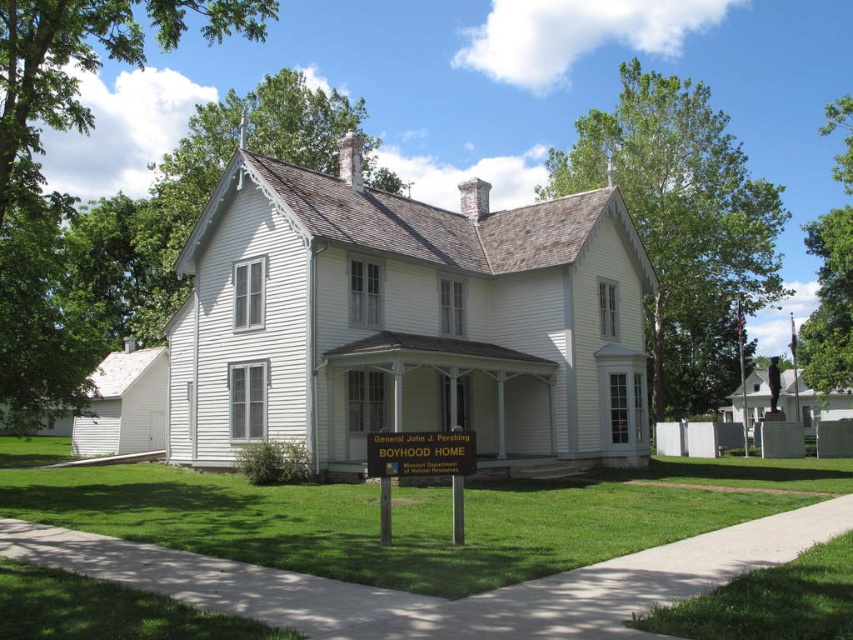
Based on the provided scene description, what are the coordinates of the green wooden sign at center?

The green wooden sign at center is located at coordinates point (x=421, y=467).

Looking at this image, what is the spatial relationship between the green wooden sign at center and the metallic gold sign at center in front of the Victorian house?

The green wooden sign at center is located below the metallic gold sign at center.